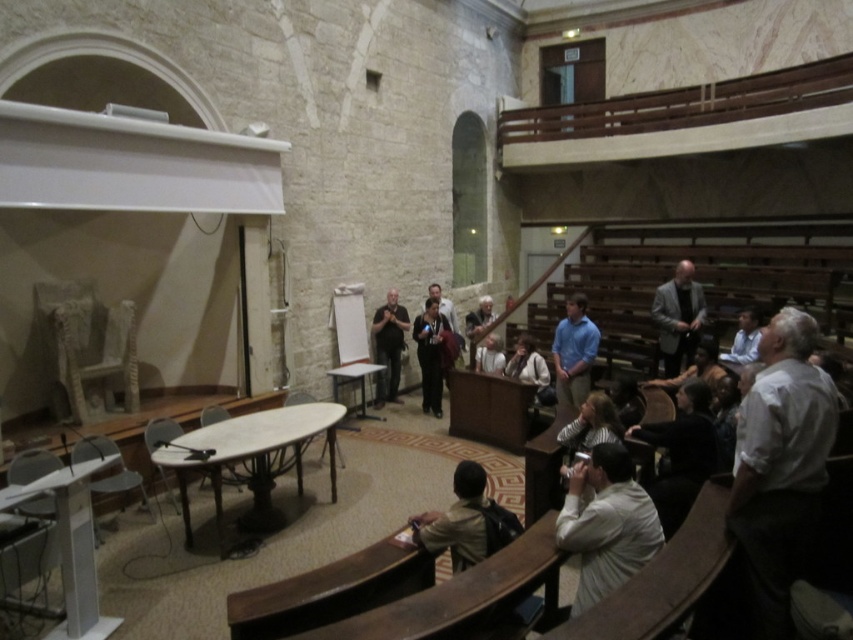
Question: Which point is farther to the camera?

Choices:
 (A) (630, 529)
 (B) (585, 337)

Answer: (B)

Question: Is dark gray shirt at center bigger than dark blue shirt at center?

Choices:
 (A) yes
 (B) no

Answer: (B)

Question: Is light beige shirt at lower right above light brown leather jacket at lower center?

Choices:
 (A) yes
 (B) no

Answer: (A)

Question: Which of the following is the farthest from the observer?

Choices:
 (A) light brown wooden guitar at center
 (B) light blue shirt at center

Answer: (A)

Question: Which of the following is the closest to the observer?

Choices:
 (A) (432, 413)
 (B) (483, 520)
 (C) (589, 364)

Answer: (B)

Question: Is light blue shirt at center below light brown wooden guitar at center?

Choices:
 (A) yes
 (B) no

Answer: (A)